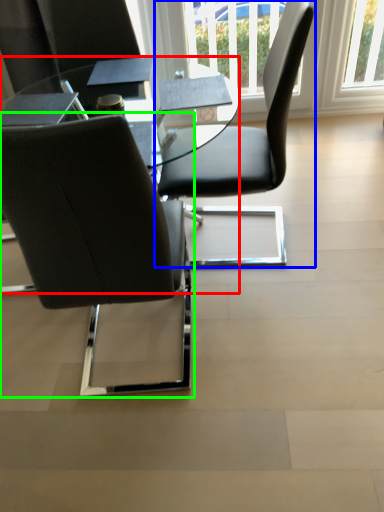
Question: Which is farther away from table (highlighted by a red box)? chair (highlighted by a blue box) or chair (highlighted by a green box)?

Choices:
 (A) chair
 (B) chair

Answer: (B)